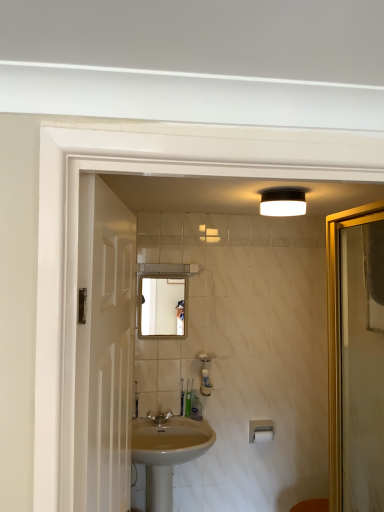
Question: From the image's perspective, is translucent plastic toothbrush at lower center, positioned as the second toiletry in right-to-left order, under green plastic toothbrush at center, the third toiletry when ordered from right to left?

Choices:
 (A) no
 (B) yes

Answer: (A)

Question: Does translucent plastic toothbrush at lower center, positioned as the second toiletry in right-to-left order, have a larger size compared to green plastic toothbrush at center, the third toiletry when ordered from right to left?

Choices:
 (A) no
 (B) yes

Answer: (A)

Question: Considering the relative sizes of translucent plastic toothbrush at lower center, positioned as the second toiletry in right-to-left order, and green plastic toothbrush at center, the third toiletry when ordered from right to left, in the image provided, is translucent plastic toothbrush at lower center, positioned as the second toiletry in right-to-left order, smaller than green plastic toothbrush at center, the third toiletry when ordered from right to left,?

Choices:
 (A) yes
 (B) no

Answer: (A)

Question: Considering the relative sizes of translucent plastic toothbrush at lower center, positioned as the second toiletry in right-to-left order, and green plastic toothbrush at center, the 1th toiletry from the left, in the image provided, is translucent plastic toothbrush at lower center, positioned as the second toiletry in right-to-left order, wider than green plastic toothbrush at center, the 1th toiletry from the left,?

Choices:
 (A) no
 (B) yes

Answer: (A)

Question: From the image's perspective, does translucent plastic toothbrush at lower center, positioned as the second toiletry in right-to-left order, appear higher than green plastic toothbrush at center, the third toiletry when ordered from right to left?

Choices:
 (A) yes
 (B) no

Answer: (A)

Question: Does translucent plastic toothbrush at lower center, positioned as the 2th toiletry in left-to-right order, come in front of green plastic toothbrush at center, the third toiletry when ordered from right to left?

Choices:
 (A) yes
 (B) no

Answer: (B)

Question: Is white matte toilet paper at lower center facing away from translucent plastic toothbrush at center, which appears as the third toiletry when viewed from the left?

Choices:
 (A) no
 (B) yes

Answer: (A)

Question: From a real-world perspective, is white matte toilet paper at lower center on translucent plastic toothbrush at center, which is the first toiletry in right-to-left order?

Choices:
 (A) no
 (B) yes

Answer: (A)

Question: Is white matte toilet paper at lower center thinner than translucent plastic toothbrush at center, which appears as the third toiletry when viewed from the left?

Choices:
 (A) no
 (B) yes

Answer: (B)

Question: Is translucent plastic toothbrush at center, which appears as the third toiletry when viewed from the left, surrounded by white matte toilet paper at lower center?

Choices:
 (A) yes
 (B) no

Answer: (B)

Question: From the image's perspective, is white matte toilet paper at lower center below translucent plastic toothbrush at center, which is the first toiletry in right-to-left order?

Choices:
 (A) no
 (B) yes

Answer: (B)

Question: Does white matte toilet paper at lower center have a larger size compared to translucent plastic toothbrush at center, which is the first toiletry in right-to-left order?

Choices:
 (A) no
 (B) yes

Answer: (A)

Question: Are white glossy screen door at left and matte silver faucet at center located far from each other?

Choices:
 (A) no
 (B) yes

Answer: (B)